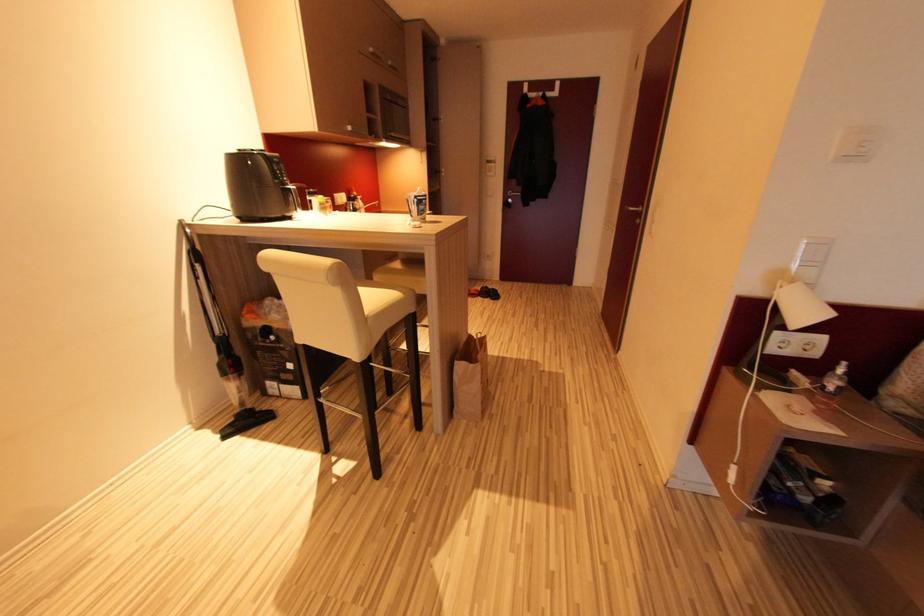
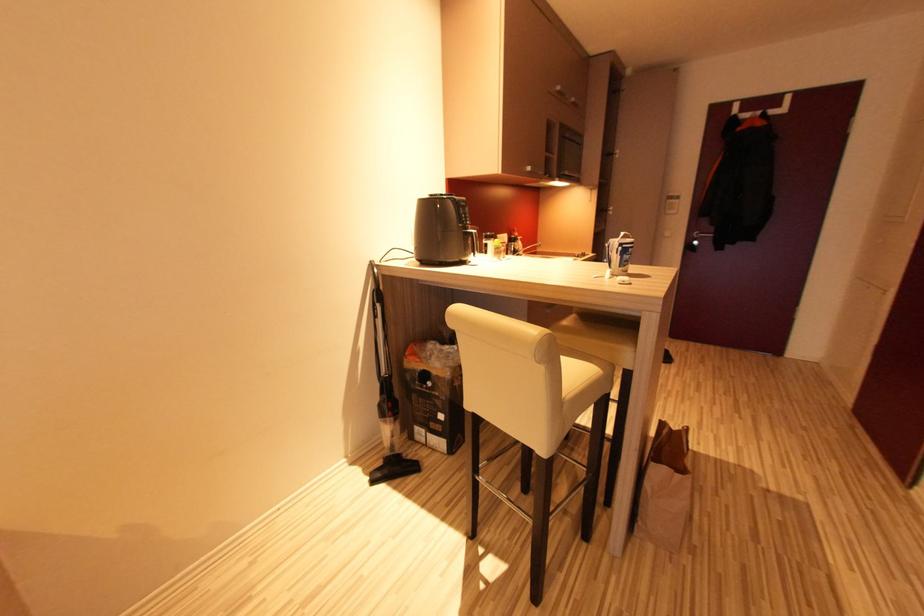
In a continuous first-person perspective shot, in which direction is the camera moving?

The movement direction of the cameraman is left, forward.